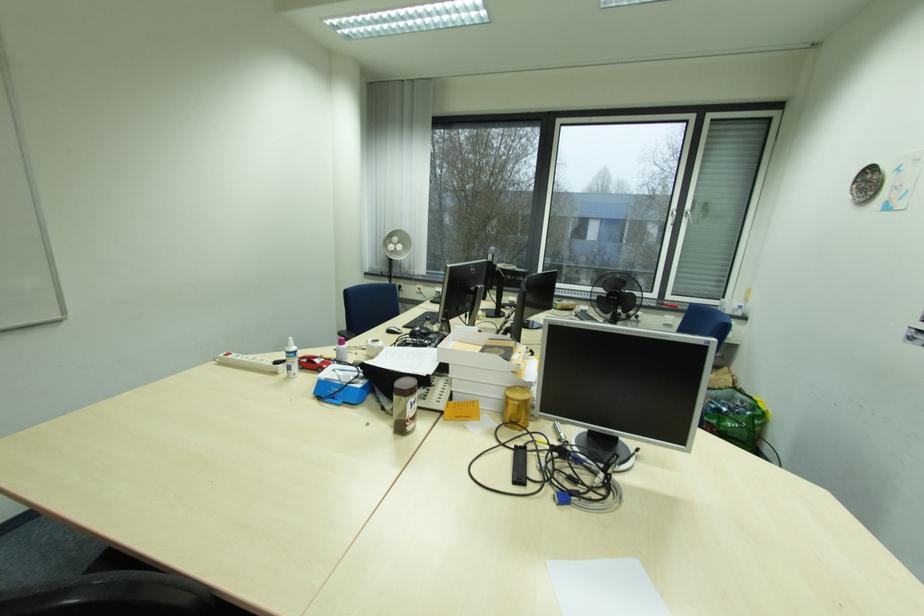
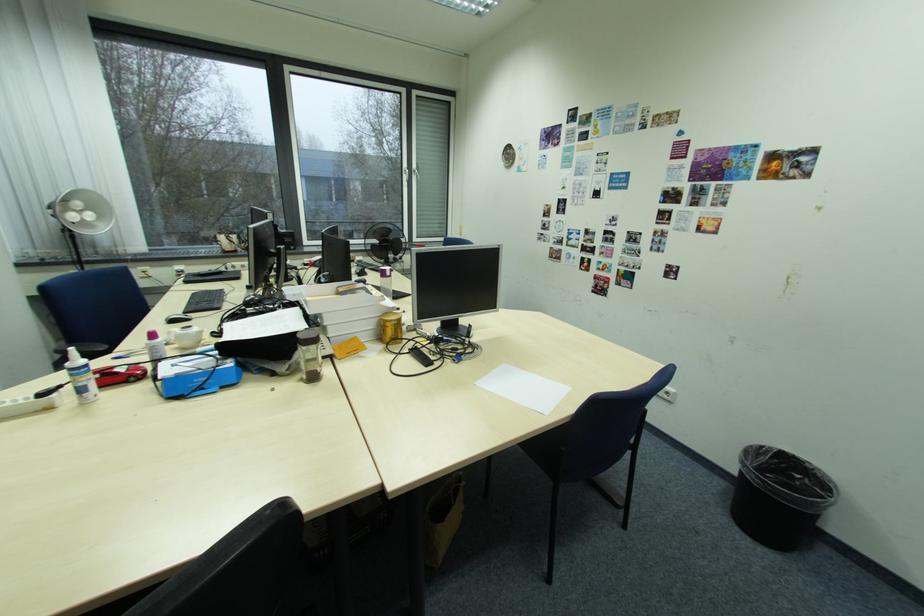
Where in the second image is the point corresponding to (397,331) from the first image?

(180, 322)